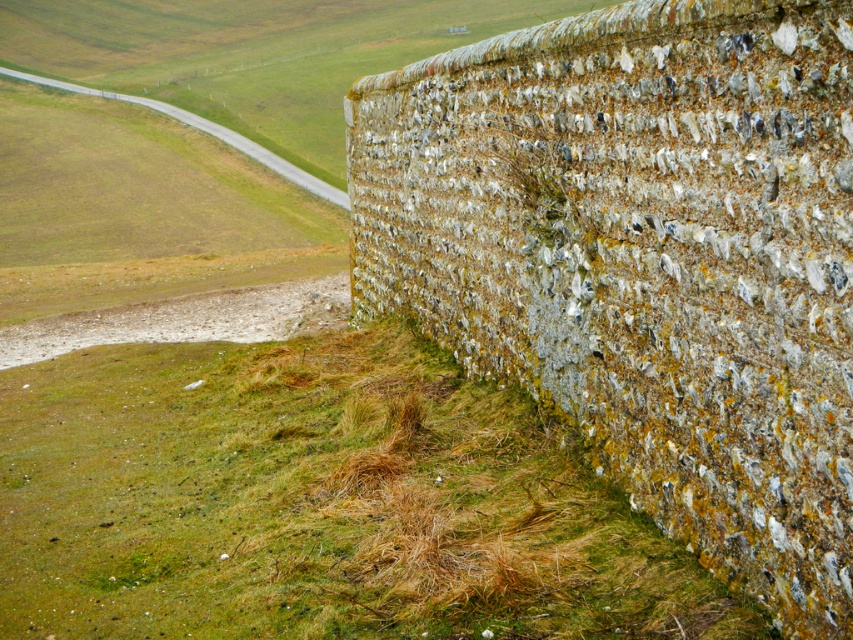
Is point (648, 408) more distant than point (451, 627)?

Yes, it is.

Which is above, speckled stone wall at right or green mossy grass at lower left?

speckled stone wall at right is above.

Image resolution: width=853 pixels, height=640 pixels. Describe the element at coordinates (645, 259) in the screenshot. I see `speckled stone wall at right` at that location.

At what (x,y) coordinates should I click in order to perform the action: click on speckled stone wall at right. Please return your answer as a coordinate pair (x, y). Image resolution: width=853 pixels, height=640 pixels. Looking at the image, I should click on (645, 259).